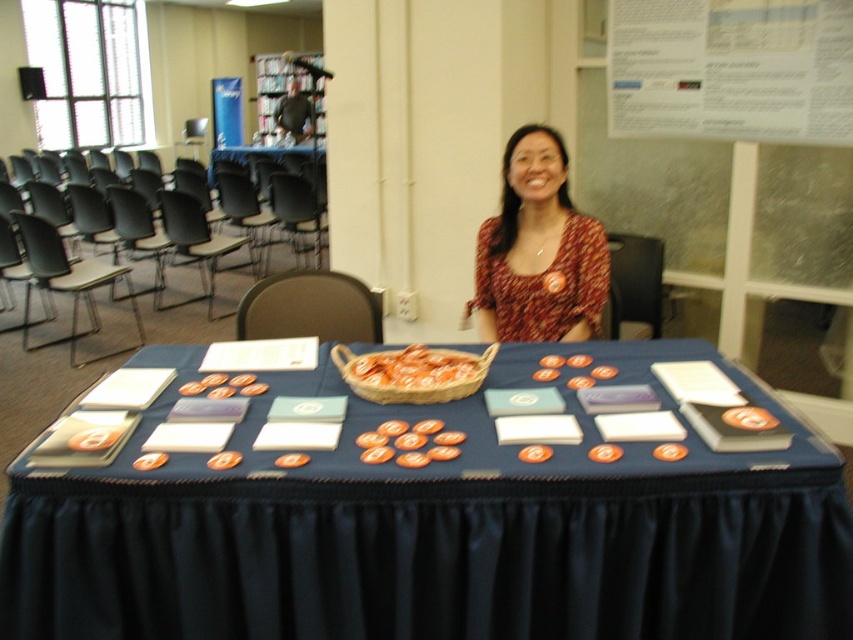
Question: Is blue fabric table at center thinner than orange matte basket at center?

Choices:
 (A) yes
 (B) no

Answer: (B)

Question: Is blue fabric table at center thinner than printed fabric blouse at center?

Choices:
 (A) no
 (B) yes

Answer: (A)

Question: Which point is closer to the camera?

Choices:
 (A) (537, 243)
 (B) (730, 516)

Answer: (B)

Question: Which object is farther from the camera taking this photo?

Choices:
 (A) orange matte basket at center
 (B) blue fabric table at center

Answer: (A)

Question: Does blue fabric table at center have a greater width compared to orange matte basket at center?

Choices:
 (A) yes
 (B) no

Answer: (A)

Question: Which point is farther to the camera?

Choices:
 (A) blue fabric table at center
 (B) printed fabric blouse at center
 (C) orange matte basket at center

Answer: (B)